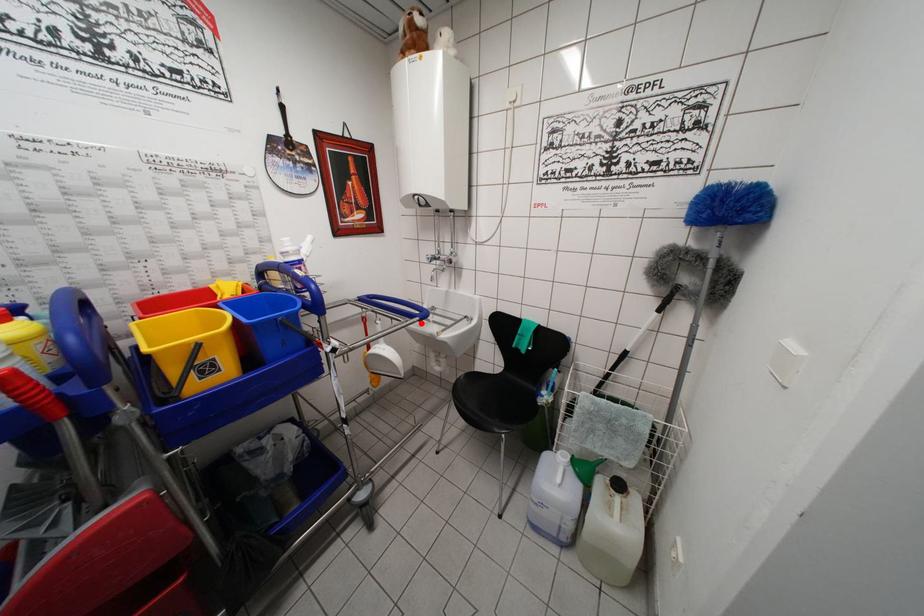
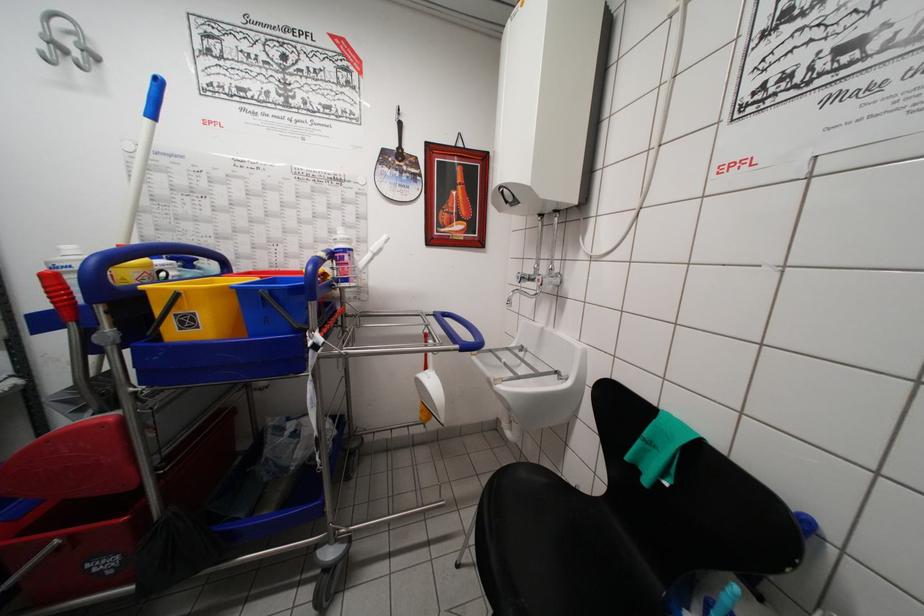
Question: I am providing you with two images of the same scene from different viewpoints. In image1, a red point is highlighted. Considering the same 3D point in image2, which of the following is correct?

Choices:
 (A) It is closer
 (B) It is farther

Answer: (B)